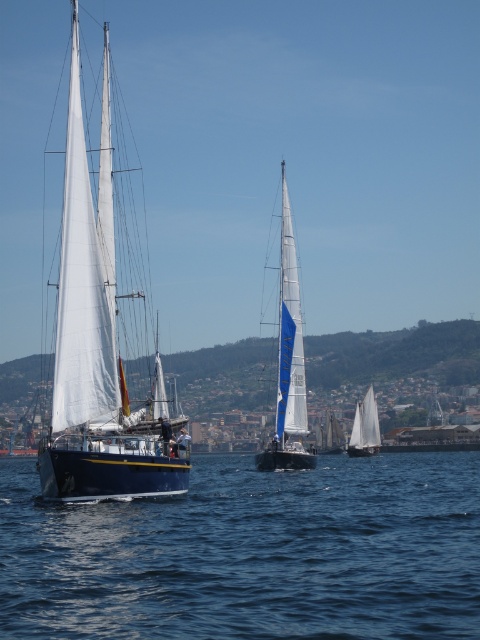
You are standing on the deck of the closer sailboat and want to determine the relative positions of two points on the water. Which point is nearer to you, point (443, 486) or point (371, 401)?

Point (443, 486) is closer to the viewer than point (371, 401), so the point nearer to you is point (443, 486).

You are a sailor standing on the deck of the white matte sailboat at center. You need to navigate to a point directly behind the blue water at lower left. Which direction should you sail relative to the current position?

To reach a point directly behind the blue water at lower left, you should sail to the right of the white matte sailboat at center since the blue water at lower left is located to the left of it.